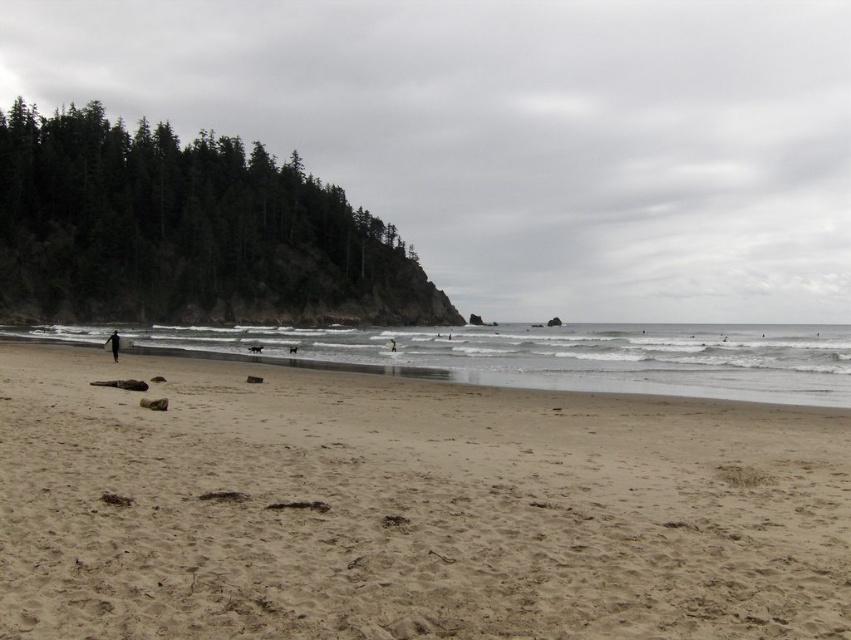
Question: Which object is farther from the camera taking this photo?

Choices:
 (A) sandy beach at lower left
 (B) sandy beach at center
 (C) black matte surfboard at lower left

Answer: (C)

Question: Which of the following is the farthest from the observer?

Choices:
 (A) white cotton surfboard at center
 (B) sandy beach at center

Answer: (A)

Question: Does sandy beach at center appear over sandy beach at lower left?

Choices:
 (A) yes
 (B) no

Answer: (B)

Question: Among these points, which one is nearest to the camera?

Choices:
 (A) (284, 636)
 (B) (392, 349)

Answer: (A)

Question: Can you confirm if brown sand at lower left is bigger than white cotton surfboard at center?

Choices:
 (A) no
 (B) yes

Answer: (B)

Question: Is brown sand at lower left below white cotton surfboard at center?

Choices:
 (A) yes
 (B) no

Answer: (B)